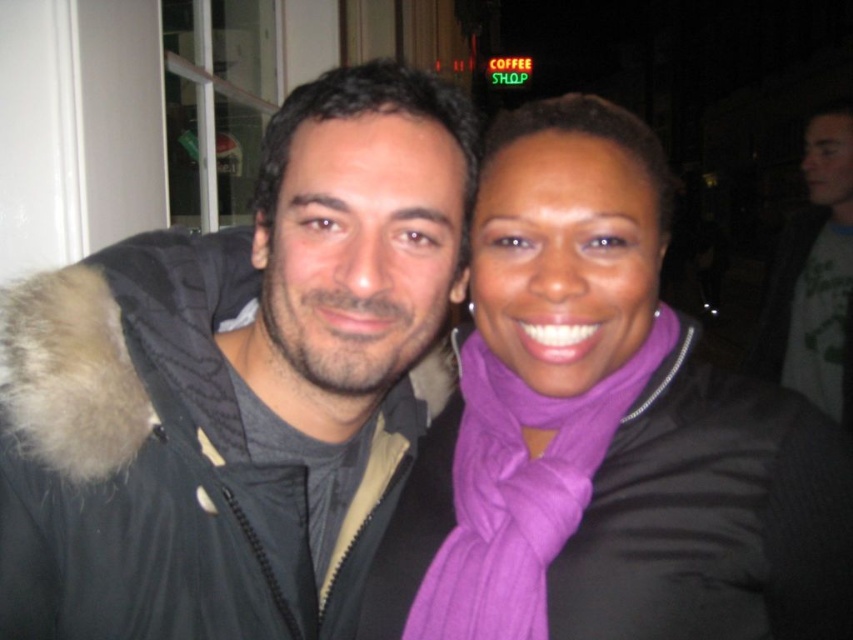
Can you confirm if matte black jacket at left is taller than matte gray jacket at right?

No.

Who is more forward, [55,358] or [839,282]?

Point [55,358] is in front.

At what (x,y) coordinates should I click in order to perform the action: click on matte black jacket at left. Please return your answer as a coordinate pair (x, y). The height and width of the screenshot is (640, 853). Looking at the image, I should click on (239, 384).

Identify the location of matte black jacket at left. (239, 384).

Between point (9, 609) and point (677, 326), which one is positioned in front?

Point (9, 609) is in front.

In the scene shown: Who is higher up, matte black jacket at left or purple soft scarf at right?

Positioned higher is matte black jacket at left.

This screenshot has height=640, width=853. What do you see at coordinates (239, 384) in the screenshot?
I see `matte black jacket at left` at bounding box center [239, 384].

Where is `matte black jacket at left`? The width and height of the screenshot is (853, 640). matte black jacket at left is located at coordinates (239, 384).

Who is positioned more to the left, purple soft scarf at right or matte gray jacket at right?

Positioned to the left is purple soft scarf at right.

Is purple soft scarf at right positioned behind matte gray jacket at right?

That is False.

Which is behind, point (489, 417) or point (851, 348)?

Point (851, 348)

You are a GUI agent. You are given a task and a screenshot of the screen. Output one action in this format:
    pyautogui.click(x=<x>, y=<y>)
    Task: Click on the purple soft scarf at right
    This screenshot has width=853, height=640.
    Given the screenshot: What is the action you would take?
    pyautogui.click(x=519, y=492)